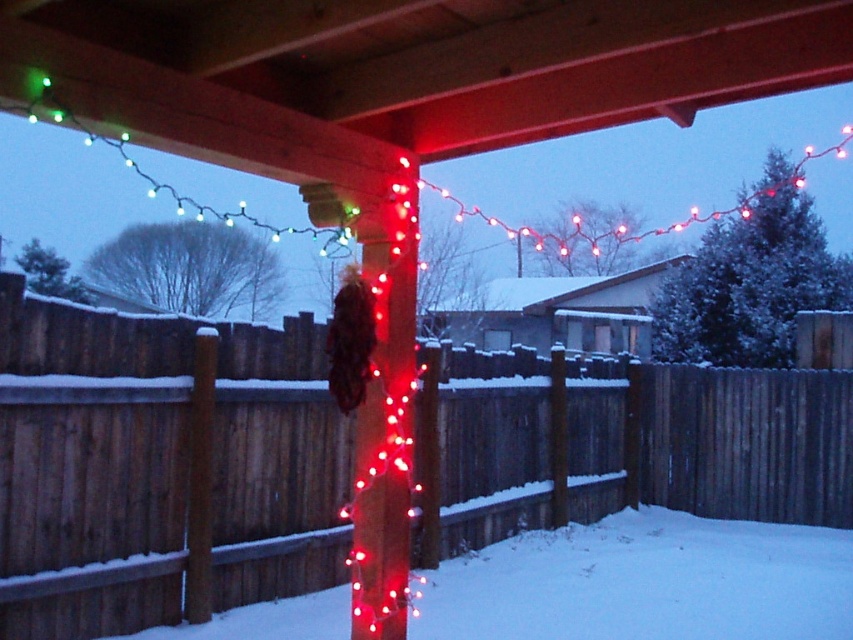
You are a delivery person trying to deliver a package to the wooden pergola structure. You see the wooden fence at center and the white powdery snow at center. Which one is bigger in size?

The wooden fence at center has a larger size compared to white powdery snow at center, so the wooden fence at center is bigger in size.

You are standing at the origin point of the image. Where is the wooden fence at center located?

The wooden fence at center is located at point (x=167, y=445).